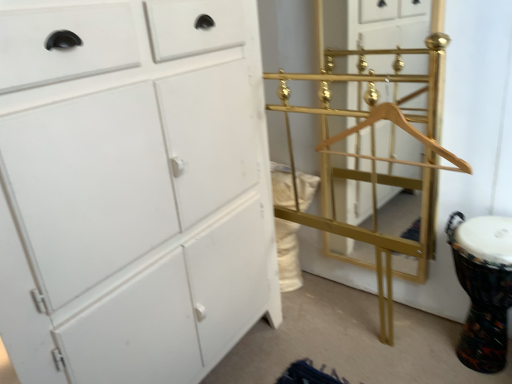
The height and width of the screenshot is (384, 512). I want to click on gold metallic coat rack at center, so click(x=387, y=24).

What are the coordinates of `gold metallic bunk bed at right` in the screenshot? It's located at (373, 156).

Find the location of `multicolored fabric drum at lower right`. multicolored fabric drum at lower right is located at coordinates (483, 287).

Which is behind, white matte cabinet at left or gold metallic coat rack at center?

gold metallic coat rack at center is behind.

You are a GUI agent. You are given a task and a screenshot of the screen. Output one action in this format:
    pyautogui.click(x=<x>, y=<y>)
    Task: Click on the glass door that appears above the white matte cabinet at left (from the image's perspective)
    This screenshot has width=512, height=384.
    Given the screenshot: What is the action you would take?
    pyautogui.click(x=387, y=24)

Which is further, (233, 99) or (404, 150)?

The point (404, 150) is behind.

Is point (127, 19) farther from camera compared to point (480, 239)?

No, it is not.

Between white matte cabinet at left and multicolored fabric drum at lower right, which one has larger width?

With larger width is white matte cabinet at left.

How different are the orientations of white matte cabinet at left and multicolored fabric drum at lower right in degrees?

They differ by 93.5 degrees in their facing directions.

From a real-world perspective, who is located lower, white matte cabinet at left or multicolored fabric drum at lower right?

In real-world perspective, multicolored fabric drum at lower right is lower.

Which object is closer to the camera, multicolored fabric drum at lower right or white matte cabinet at left?

white matte cabinet at left is closer to the camera.

Is multicolored fabric drum at lower right far from white matte cabinet at left?

No, multicolored fabric drum at lower right is not far from white matte cabinet at left.

Locate an element on the screen. This screenshot has height=384, width=512. drum below the white matte cabinet at left (from a real-world perspective) is located at coordinates (483, 287).

From the image's perspective, is multicolored fabric drum at lower right on top of white matte cabinet at left?

No.

Are gold metallic bunk bed at right and multicolored fabric drum at lower right far apart?

They are positioned close to each other.

Is gold metallic bunk bed at right bigger or smaller than multicolored fabric drum at lower right?

gold metallic bunk bed at right is smaller than multicolored fabric drum at lower right.

From the image's perspective, which object appears higher, gold metallic bunk bed at right or multicolored fabric drum at lower right?

gold metallic bunk bed at right, from the image's perspective.

From the picture: Considering the relative positions of gold metallic bunk bed at right and multicolored fabric drum at lower right in the image provided, is gold metallic bunk bed at right to the left or to the right of multicolored fabric drum at lower right?

Clearly, gold metallic bunk bed at right is on the left of multicolored fabric drum at lower right in the image.

From the picture: Could you tell me if gold metallic bunk bed at right is turned towards white matte cabinet at left?

Yes, gold metallic bunk bed at right faces towards white matte cabinet at left.

Looking at their sizes, would you say gold metallic bunk bed at right is wider or thinner than white matte cabinet at left?

Clearly, gold metallic bunk bed at right has less width compared to white matte cabinet at left.

Can you tell me how much gold metallic bunk bed at right and white matte cabinet at left differ in facing direction?

There is a 93.5-degree angle between the facing directions of gold metallic bunk bed at right and white matte cabinet at left.

Do you think gold metallic bunk bed at right is within gold metallic coat rack at center, or outside of it?

gold metallic bunk bed at right is located beyond the bounds of gold metallic coat rack at center.

Is gold metallic bunk bed at right turned away from gold metallic coat rack at center?

Yes, gold metallic bunk bed at right is positioned with its back facing gold metallic coat rack at center.

From a real-world perspective, which object stands above the other?

In real-world perspective, gold metallic coat rack at center is above.

Based on the photo, how distant is gold metallic bunk bed at right from gold metallic coat rack at center?

gold metallic bunk bed at right is 9.06 inches from gold metallic coat rack at center.

Can we say multicolored fabric drum at lower right lies outside gold metallic bunk bed at right?

Yes, multicolored fabric drum at lower right is outside of gold metallic bunk bed at right.

Considering the relative sizes of multicolored fabric drum at lower right and gold metallic bunk bed at right in the image provided, is multicolored fabric drum at lower right thinner than gold metallic bunk bed at right?

Incorrect, the width of multicolored fabric drum at lower right is not less than that of gold metallic bunk bed at right.

Considering the positions of objects multicolored fabric drum at lower right and gold metallic bunk bed at right in the image provided, who is more to the left, multicolored fabric drum at lower right or gold metallic bunk bed at right?

From the viewer's perspective, gold metallic bunk bed at right appears more on the left side.

Which is less distant, (462, 334) or (368, 90)?

Point (462, 334) appears to be closer to the viewer than point (368, 90).

You are a GUI agent. You are given a task and a screenshot of the screen. Output one action in this format:
    pyautogui.click(x=<x>, y=<y>)
    Task: Click on the glass door that appears behind the white matte cabinet at left
    This screenshot has height=384, width=512.
    Given the screenshot: What is the action you would take?
    pyautogui.click(x=387, y=24)

Find the location of a particular element. This screenshot has height=384, width=512. chest of drawers on the left of the multicolored fabric drum at lower right is located at coordinates (132, 189).

Considering their positions, is gold metallic bunk bed at right positioned closer to white matte cabinet at left than gold metallic coat rack at center?

Based on the image, gold metallic bunk bed at right appears to be nearer to white matte cabinet at left.

Based on the photo, based on their spatial positions, is white matte cabinet at left or gold metallic bunk bed at right further from gold metallic coat rack at center?

The object further to gold metallic coat rack at center is white matte cabinet at left.

Estimate the real-world distances between objects in this image. Which object is further from white matte cabinet at left, gold metallic coat rack at center or gold metallic bunk bed at right?

gold metallic coat rack at center lies further to white matte cabinet at left than the other object.

Estimate the real-world distances between objects in this image. Which object is further from multicolored fabric drum at lower right, gold metallic bunk bed at right or white matte cabinet at left?

white matte cabinet at left is further to multicolored fabric drum at lower right.

Which object lies further to the anchor point gold metallic coat rack at center, gold metallic bunk bed at right or multicolored fabric drum at lower right?

Based on the image, multicolored fabric drum at lower right appears to be further to gold metallic coat rack at center.

Based on their spatial positions, is gold metallic bunk bed at right or white matte cabinet at left further from gold metallic coat rack at center?

Based on the image, white matte cabinet at left appears to be further to gold metallic coat rack at center.

Considering their positions, is white matte cabinet at left positioned further to multicolored fabric drum at lower right than gold metallic bunk bed at right?

white matte cabinet at left is positioned further to the anchor multicolored fabric drum at lower right.

Consider the image. Estimate the real-world distances between objects in this image. Which object is further from white matte cabinet at left, gold metallic coat rack at center or multicolored fabric drum at lower right?

The object further to white matte cabinet at left is gold metallic coat rack at center.

The image size is (512, 384). I want to click on bunk bed located between white matte cabinet at left and multicolored fabric drum at lower right in the left-right direction, so click(373, 156).

Locate an element on the screen. The width and height of the screenshot is (512, 384). glass door located between white matte cabinet at left and gold metallic bunk bed at right in the left-right direction is located at coordinates (387, 24).

In order to click on glass door between white matte cabinet at left and multicolored fabric drum at lower right in the horizontal direction in this screenshot , I will do `click(387, 24)`.

You are a GUI agent. You are given a task and a screenshot of the screen. Output one action in this format:
    pyautogui.click(x=<x>, y=<y>)
    Task: Click on the bunk bed between gold metallic coat rack at center and multicolored fabric drum at lower right in the vertical direction
    
    Given the screenshot: What is the action you would take?
    pyautogui.click(x=373, y=156)